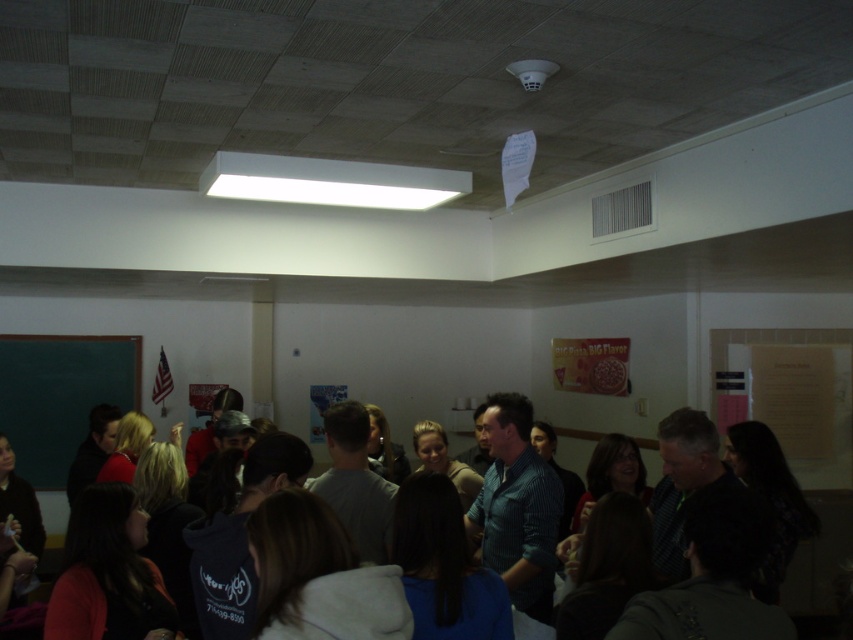
Question: Can you confirm if blue denim shirt at center is bigger than blue striped shirt at center?

Choices:
 (A) no
 (B) yes

Answer: (B)

Question: Which object is farther from the camera taking this photo?

Choices:
 (A) blue striped shirt at center
 (B) green chalkboard at left

Answer: (B)

Question: Estimate the real-world distances between objects in this image. Which object is closer to the blue denim shirt at center?

Choices:
 (A) blue striped shirt at center
 (B) green chalkboard at left

Answer: (A)

Question: Does blue denim shirt at center come in front of green chalkboard at left?

Choices:
 (A) no
 (B) yes

Answer: (B)

Question: Is blue denim shirt at center positioned in front of blue striped shirt at center?

Choices:
 (A) yes
 (B) no

Answer: (A)

Question: Which object is farther from the camera taking this photo?

Choices:
 (A) blue striped shirt at center
 (B) blue denim shirt at center

Answer: (A)